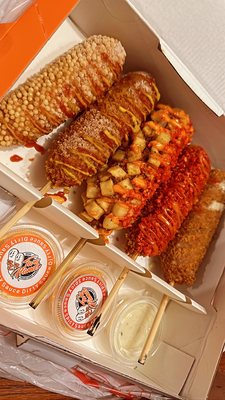
Identify the location of table. This screenshot has width=225, height=400. (16, 398).